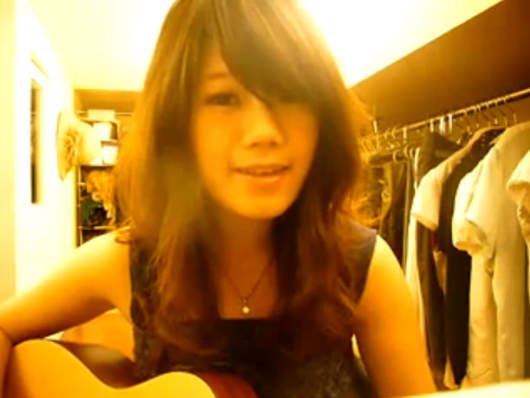
Locate an element on the screen. The width and height of the screenshot is (530, 398). hanger rod is located at coordinates (419, 126).